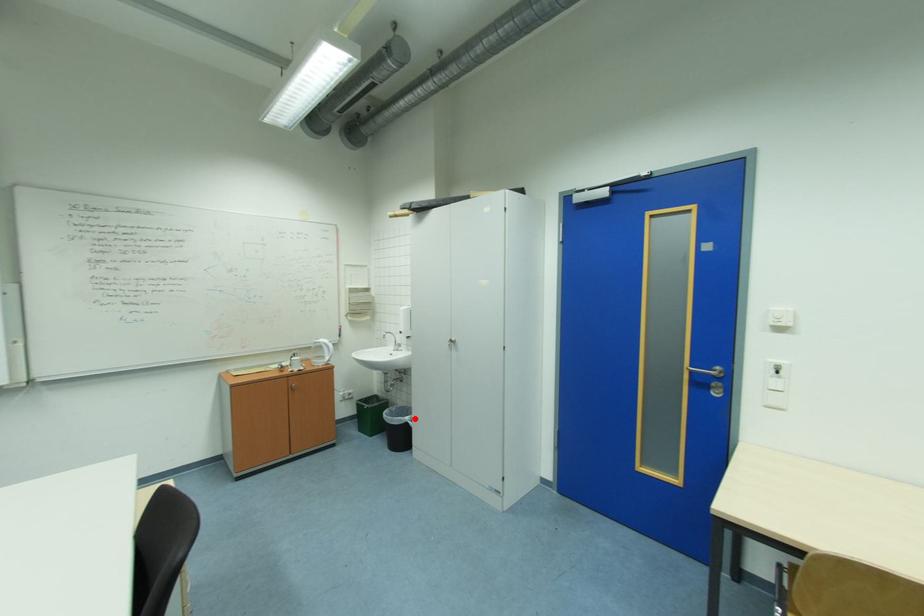
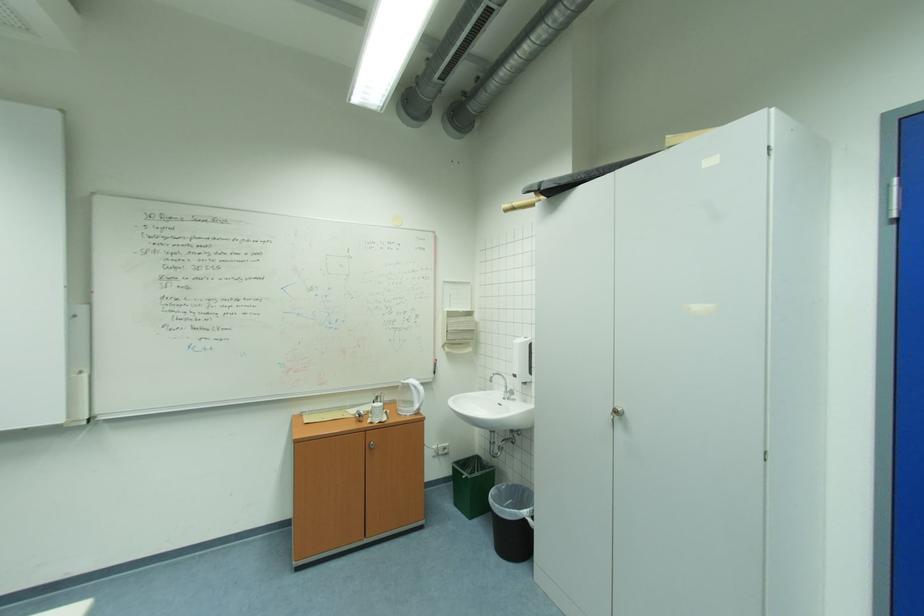
Question: A red point is marked in image1. In image2, is the corresponding 3D point closer to the camera or farther? Reply with the corresponding letter.

Choices:
 (A) The corresponding 3D point is closer.
 (B) The corresponding 3D point is farther.

Answer: (A)